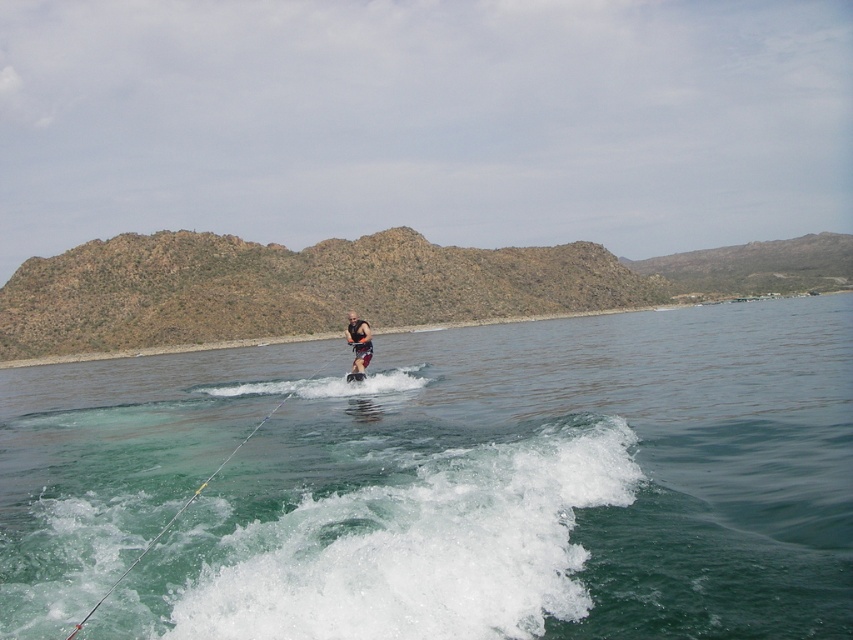
Can you confirm if clear water at center is taller than white frothy water at lower center?

Yes.

Looking at this image, which is more to the right, clear water at center or white frothy water at lower center?

clear water at center

Is point (323, 506) behind point (422, 516)?

Yes, it is.

Locate an element on the screen. This screenshot has width=853, height=640. clear water at center is located at coordinates (445, 483).

Between clear water at center and metallic silver rope at lower center, which one has more height?

clear water at center

Is clear water at center bigger than metallic silver rope at lower center?

Indeed, clear water at center has a larger size compared to metallic silver rope at lower center.

Who is more forward, (405, 378) or (160, 536)?

Point (160, 536)

You are a GUI agent. You are given a task and a screenshot of the screen. Output one action in this format:
    pyautogui.click(x=<x>, y=<y>)
    Task: Click on the clear water at center
    The image size is (853, 640).
    Given the screenshot: What is the action you would take?
    pyautogui.click(x=445, y=483)

Between metallic silver rope at lower center and orange life vest at center, which one is positioned lower?

A: metallic silver rope at lower center is lower down.

Between metallic silver rope at lower center and orange life vest at center, which one appears on the left side from the viewer's perspective?

orange life vest at center is more to the left.

Between point (183, 502) and point (349, 314), which one is positioned in front?

Point (183, 502) is in front.

Where is `metallic silver rope at lower center`? This screenshot has width=853, height=640. metallic silver rope at lower center is located at coordinates (184, 508).